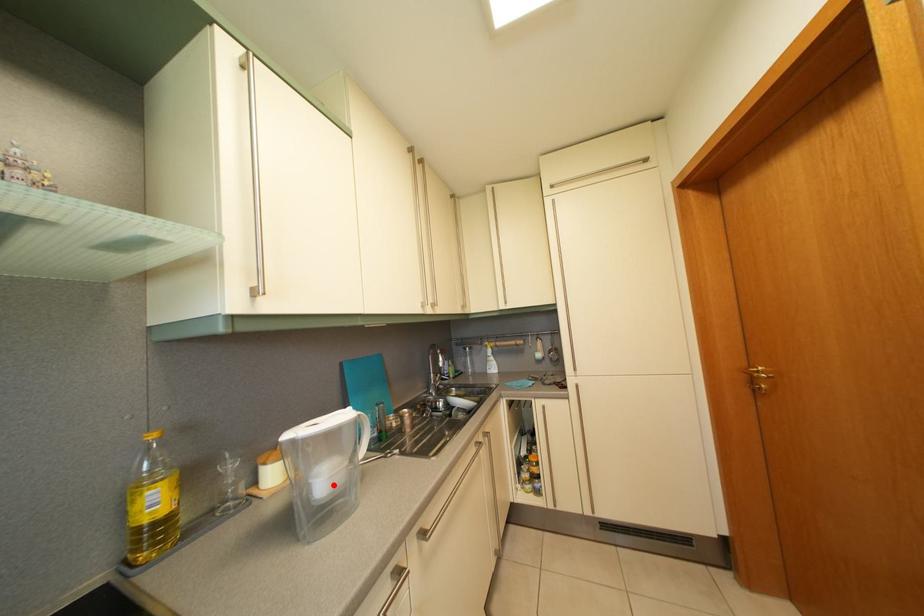
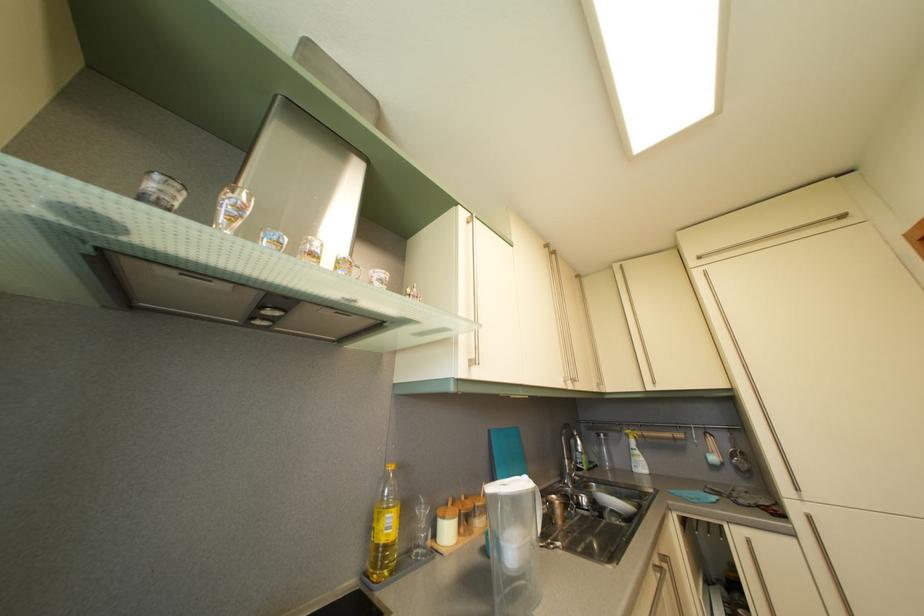
The point at the highlighted location is marked in the first image. Where is the corresponding point in the second image?

(521, 554)